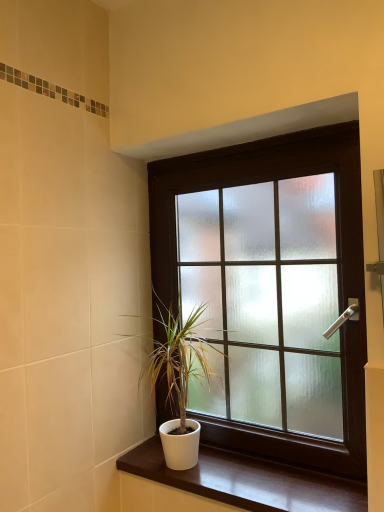
Question: Is the position of white glossy wood at lower center less distant than that of white matte pot at lower center?

Choices:
 (A) yes
 (B) no

Answer: (A)

Question: Can you confirm if white glossy wood at lower center is smaller than white matte pot at lower center?

Choices:
 (A) yes
 (B) no

Answer: (A)

Question: Can you see white glossy wood at lower center touching white matte pot at lower center?

Choices:
 (A) yes
 (B) no

Answer: (B)

Question: Does white glossy wood at lower center lie behind white matte pot at lower center?

Choices:
 (A) no
 (B) yes

Answer: (A)

Question: From the image's perspective, is white glossy wood at lower center on top of white matte pot at lower center?

Choices:
 (A) yes
 (B) no

Answer: (B)

Question: Does white glossy wood at lower center appear on the right side of white matte pot at lower center?

Choices:
 (A) no
 (B) yes

Answer: (B)

Question: Is white matte pot at lower center oriented towards frosted glass window at center?

Choices:
 (A) yes
 (B) no

Answer: (B)

Question: Can you confirm if white matte pot at lower center is positioned to the left of frosted glass window at center?

Choices:
 (A) yes
 (B) no

Answer: (A)

Question: Considering the relative sizes of white matte pot at lower center and frosted glass window at center in the image provided, is white matte pot at lower center taller than frosted glass window at center?

Choices:
 (A) no
 (B) yes

Answer: (A)

Question: Is white matte pot at lower center facing away from frosted glass window at center?

Choices:
 (A) yes
 (B) no

Answer: (A)

Question: Is the position of white matte pot at lower center less distant than that of frosted glass window at center?

Choices:
 (A) yes
 (B) no

Answer: (B)

Question: Can you confirm if white matte pot at lower center is wider than frosted glass window at center?

Choices:
 (A) no
 (B) yes

Answer: (B)

Question: From a real-world perspective, is white glossy wood at lower center located higher than frosted glass window at center?

Choices:
 (A) no
 (B) yes

Answer: (A)